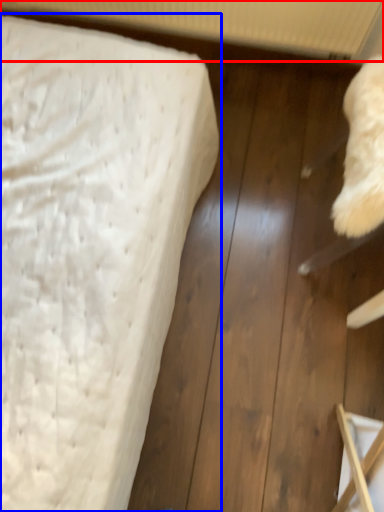
Question: Among these objects, which one is farthest to the camera, radiator (highlighted by a red box) or bed (highlighted by a blue box)?

Choices:
 (A) radiator
 (B) bed

Answer: (A)